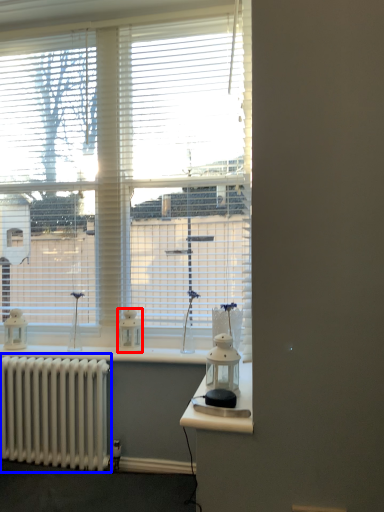
Question: Which object appears farthest to the camera in this image, appliance (highlighted by a red box) or radiator (highlighted by a blue box)?

Choices:
 (A) appliance
 (B) radiator

Answer: (A)